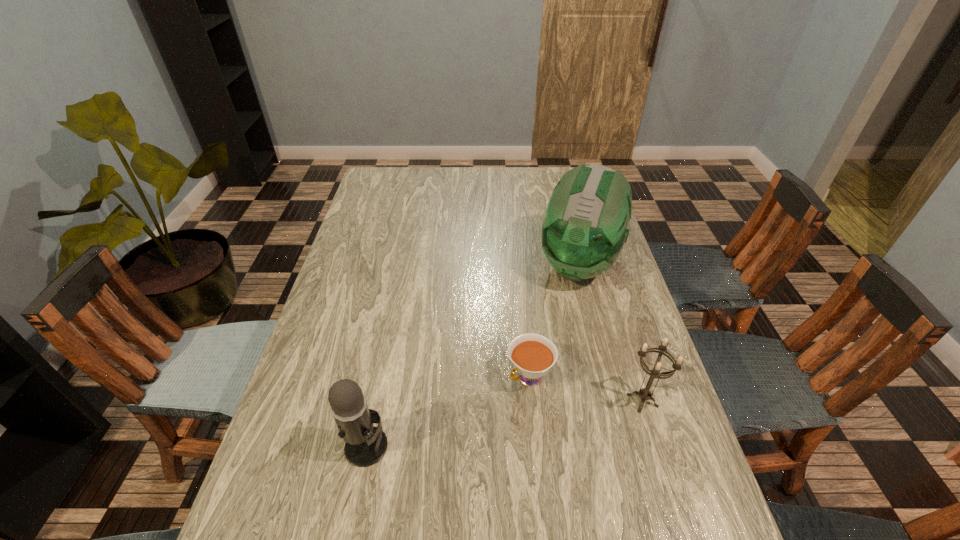
This screenshot has height=540, width=960. Find the location of `unoccupied area between the teacup and the candle holder`. unoccupied area between the teacup and the candle holder is located at coordinates (586, 389).

You are a GUI agent. You are given a task and a screenshot of the screen. Output one action in this format:
    pyautogui.click(x=<x>, y=<y>)
    Task: Click on the free space between the farthest object and the third tallest object
    This screenshot has width=960, height=540.
    Given the screenshot: What is the action you would take?
    pyautogui.click(x=611, y=332)

Locate an element on the screen. The width and height of the screenshot is (960, 540). object that is the nearest to the third shortest object is located at coordinates (532, 355).

Identify which object is the closest to the third tallest object. Please provide its 2D coordinates. Your answer should be formatted as a tuple, i.e. [(x, y)], where the tuple contains the x and y coordinates of a point satisfying the conditions above.

[(532, 355)]

Locate an element on the screen. The height and width of the screenshot is (540, 960). free space that satisfies the following two spatial constraints: 1. on the back side of the third shortest object; 2. on the left side of the candle holder is located at coordinates (375, 400).

The width and height of the screenshot is (960, 540). I want to click on free space that satisfies the following two spatial constraints: 1. on the back side of the shortest object; 2. on the right side of the microphone, so click(380, 377).

Identify the location of vacant region that satisfies the following two spatial constraints: 1. on the back side of the leftmost object; 2. on the right side of the tallest object. The image size is (960, 540). (402, 264).